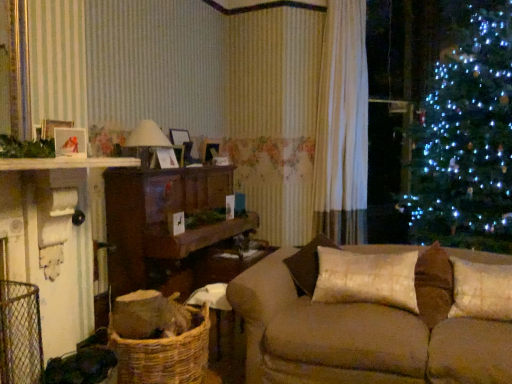
Question: Considering the relative positions of matte white picture frame at left and white sheer curtain at center in the image provided, is matte white picture frame at left to the left or to the right of white sheer curtain at center?

Choices:
 (A) left
 (B) right

Answer: (A)

Question: Relative to white sheer curtain at center, is matte white picture frame at left in front or behind?

Choices:
 (A) behind
 (B) front

Answer: (B)

Question: Which is nearer to the white textured pillow at right, positioned as the 2th pillow in left-to-right order?

Choices:
 (A) white sheer curtain at center
 (B) matte white lampshade at center
 (C) matte white picture frame at left
 (D) wooden cabinet at center
 (E) satin beige pillow at center, the second pillow from the right

Answer: (E)

Question: Which of these objects is positioned closest to the matte white picture frame at left?

Choices:
 (A) matte white lampshade at center
 (B) woven brown basket at lower left
 (C) wooden cabinet at center
 (D) satin beige pillow at center, which ranks as the 1th pillow in left-to-right order
 (E) white sheer curtain at center

Answer: (A)